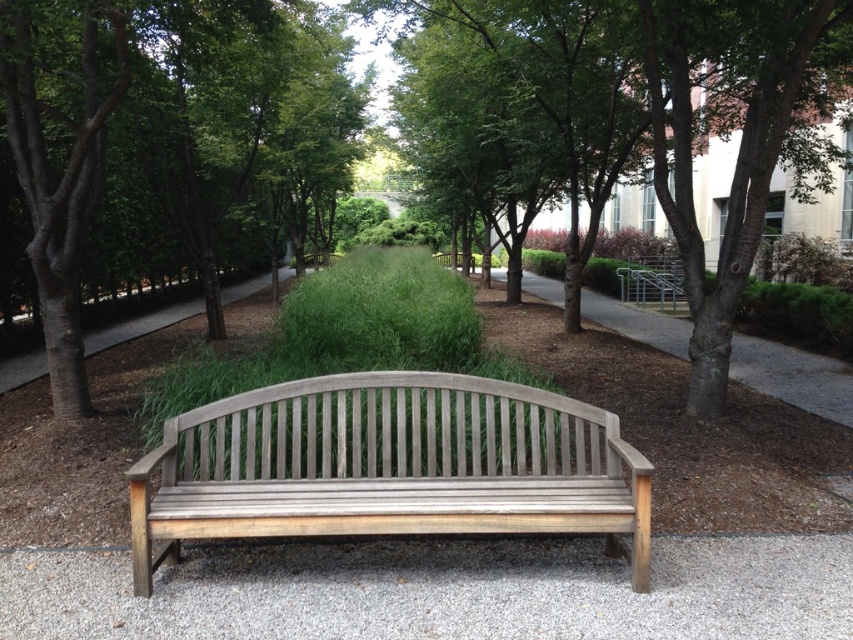
Question: Which is farther from the gray gravel at center?

Choices:
 (A) brown wood tree at center
 (B) brown gravel path at left

Answer: (B)

Question: Which of these objects is positioned closest to the green leafy tree at center?

Choices:
 (A) brown gravel path at left
 (B) gray wood bench at center
 (C) brown wood tree at center
 (D) gray gravel at center

Answer: (B)

Question: Considering the relative positions of gray gravel at center and green leafy tree at center in the image provided, where is gray gravel at center located with respect to green leafy tree at center?

Choices:
 (A) below
 (B) above

Answer: (A)

Question: Among these objects, which one is nearest to the camera?

Choices:
 (A) gray wood bench at center
 (B) gray gravel at center
 (C) brown gravel path at left
 (D) brown wood tree at center

Answer: (B)

Question: Can you confirm if gray gravel at center is wider than brown wood tree at center?

Choices:
 (A) no
 (B) yes

Answer: (B)

Question: Can you confirm if green leafy tree at center is smaller than brown gravel path at left?

Choices:
 (A) yes
 (B) no

Answer: (B)